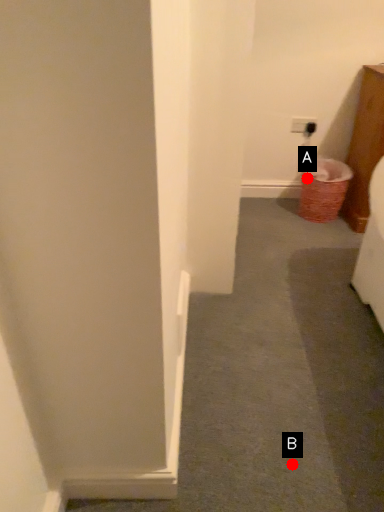
Question: Two points are circled on the image, labeled by A and B beside each circle. Which point appears closest to the camera in this image?

Choices:
 (A) A is closer
 (B) B is closer

Answer: (B)